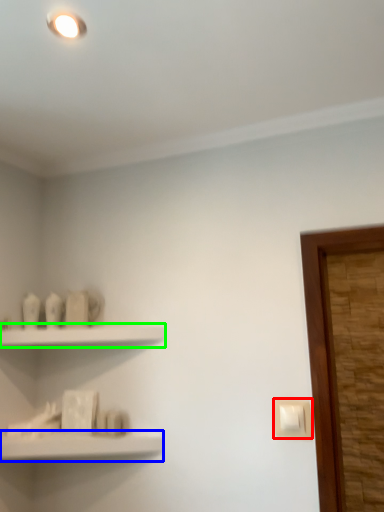
Question: Based on their relative distances, which object is nearer to light switch (highlighted by a red box)? Choose from shelf (highlighted by a blue box) and shelf (highlighted by a green box).

Choices:
 (A) shelf
 (B) shelf

Answer: (A)